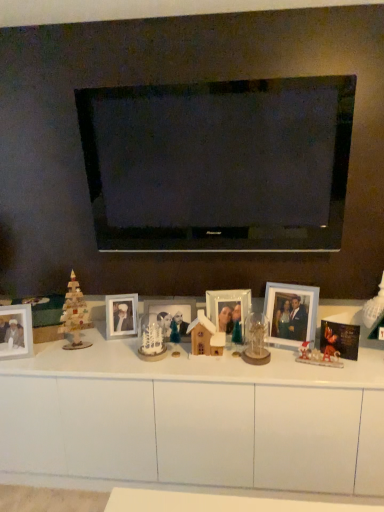
You are a GUI agent. You are given a task and a screenshot of the screen. Output one action in this format:
    pyautogui.click(x=<x>, y=<y>)
    Task: Click on the vacant area situated to the left side of wooden christmas tree at left
    
    Given the screenshot: What is the action you would take?
    pyautogui.click(x=38, y=354)